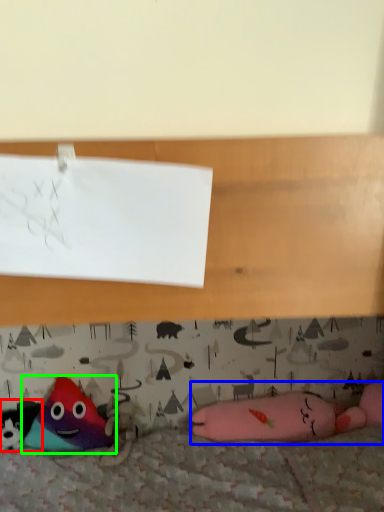
Question: Considering the real-world distances, which object is closest to toy (highlighted by a red box)? toy (highlighted by a blue box) or toy (highlighted by a green box).

Choices:
 (A) toy
 (B) toy

Answer: (B)